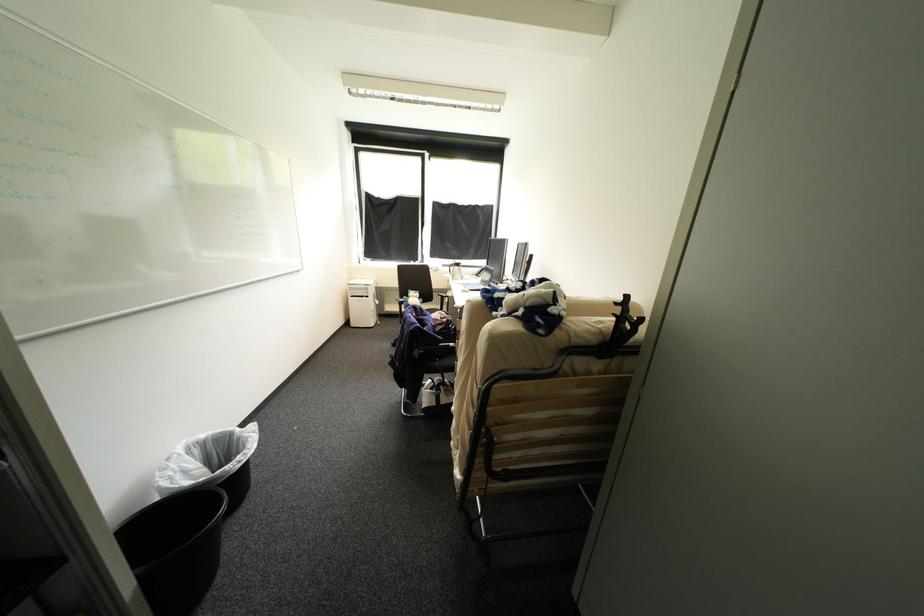
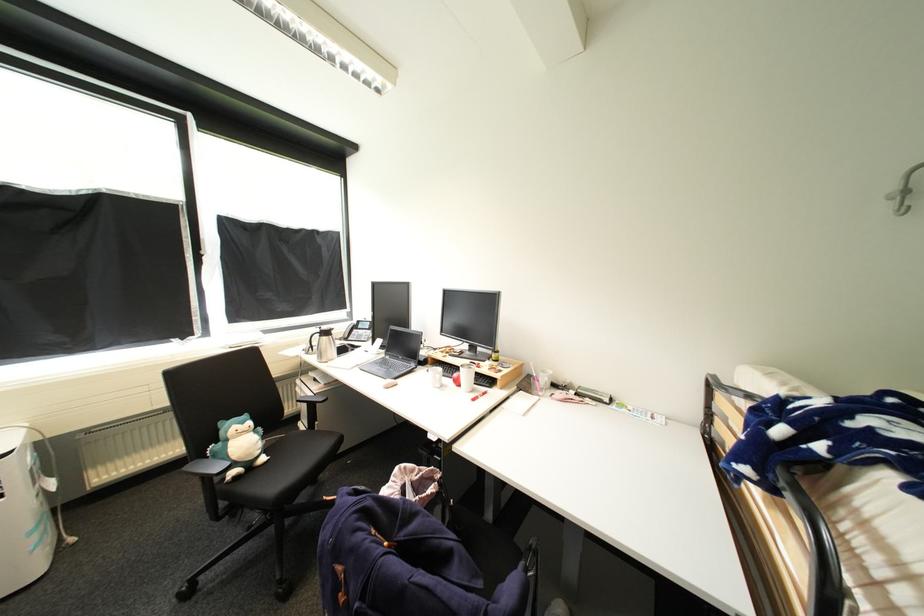
Find the pixel in the second image that matches [427,318] in the first image.

(408, 537)